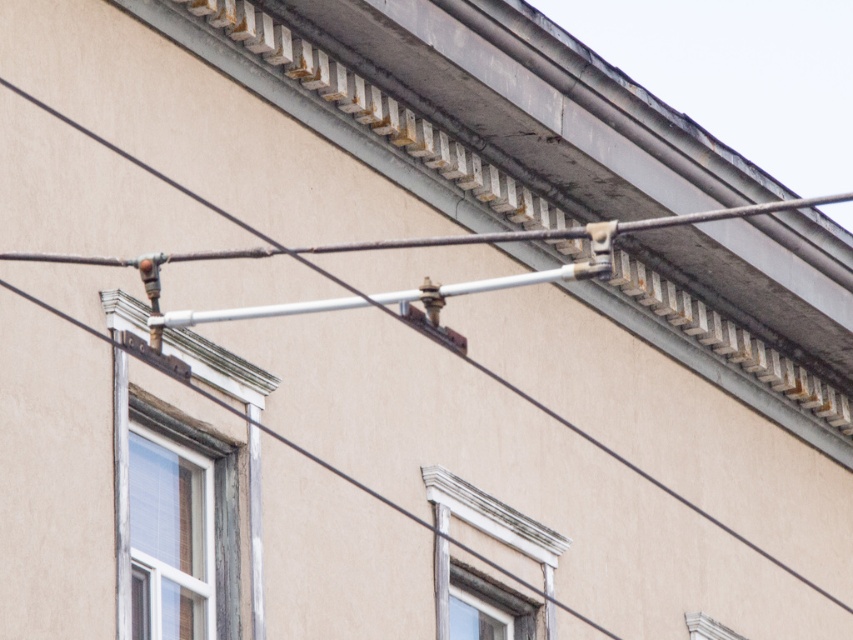
Between wooden window at left and white painted wood window at center, which one is positioned higher?

Positioned higher is wooden window at left.

Can you confirm if wooden window at left is bigger than white painted wood window at center?

Yes, wooden window at left is bigger than white painted wood window at center.

Who is more distant from viewer, (x=233, y=566) or (x=500, y=522)?

Point (x=500, y=522)

You are a GUI agent. You are given a task and a screenshot of the screen. Output one action in this format:
    pyautogui.click(x=<x>, y=<y>)
    Task: Click on the wooden window at left
    
    Given the screenshot: What is the action you would take?
    pyautogui.click(x=213, y=497)

Which is in front, point (131, 416) or point (471, 593)?

Point (131, 416) is in front.

Which is in front, point (236, 452) or point (461, 566)?

Positioned in front is point (236, 452).

You are a GUI agent. You are given a task and a screenshot of the screen. Output one action in this format:
    pyautogui.click(x=<x>, y=<y>)
    Task: Click on the wooden window at left
    This screenshot has width=853, height=640.
    Given the screenshot: What is the action you would take?
    pyautogui.click(x=213, y=497)

Between point (469, 518) and point (498, 588), which one is positioned in front?

Positioned in front is point (469, 518).

Who is positioned more to the left, white painted wood window at center or wooden window frame at lower center?

white painted wood window at center

You are a GUI agent. You are given a task and a screenshot of the screen. Output one action in this format:
    pyautogui.click(x=<x>, y=<y>)
    Task: Click on the white painted wood window at center
    
    Given the screenshot: What is the action you would take?
    pyautogui.click(x=492, y=518)